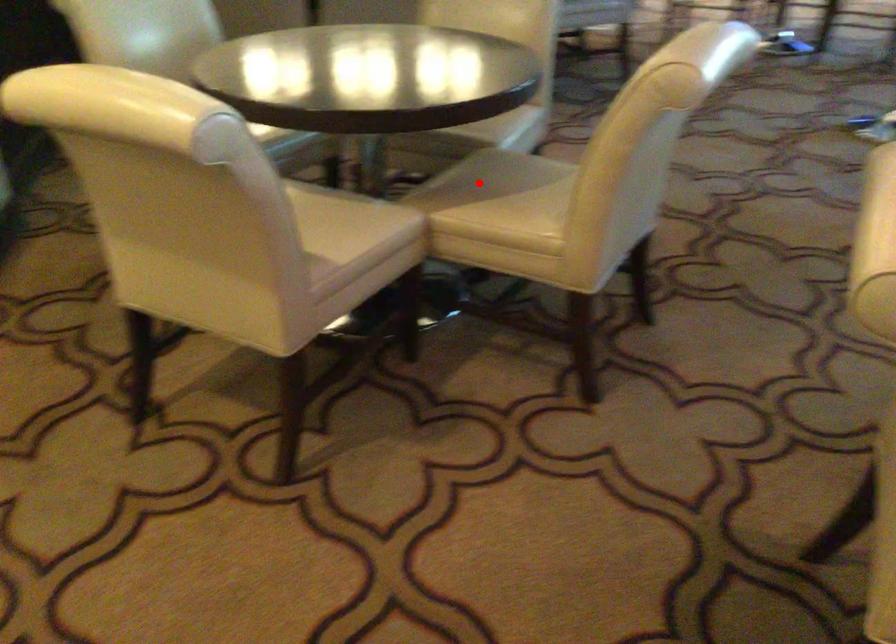
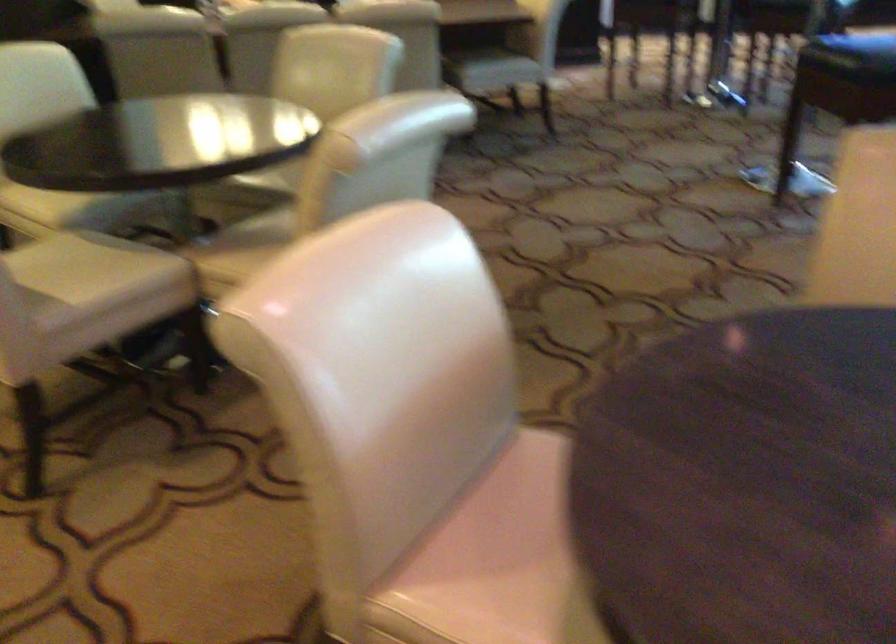
Locate, in the second image, the point that corresponds to the highlighted location in the first image.

(259, 234)